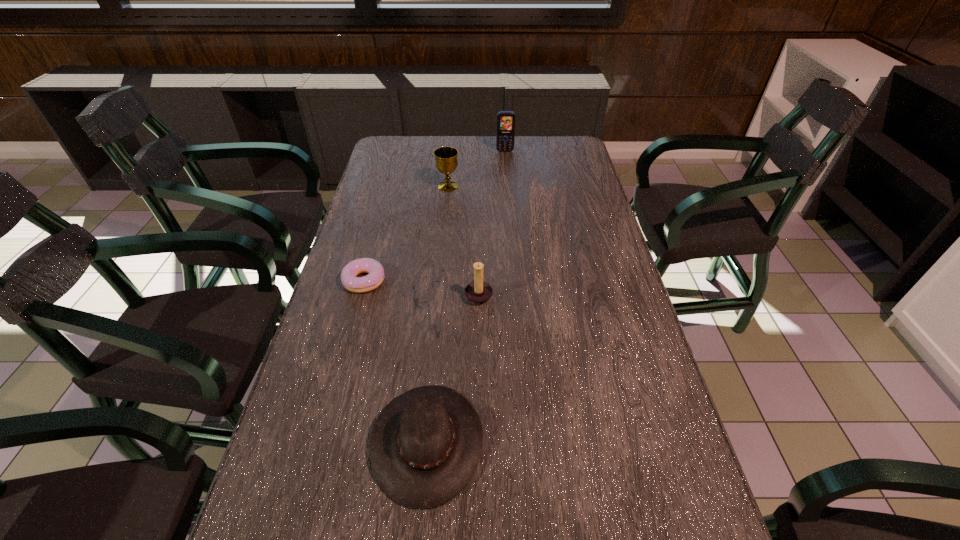
I want to click on cellular telephone, so click(505, 135).

Image resolution: width=960 pixels, height=540 pixels. What are the coordinates of `the farthest object` in the screenshot? It's located at [505, 135].

The height and width of the screenshot is (540, 960). I want to click on the fourth nearest object, so click(446, 162).

Where is `candle holder`? This screenshot has height=540, width=960. candle holder is located at coordinates (478, 292).

Where is `the second shortest object`? The image size is (960, 540). the second shortest object is located at coordinates (425, 445).

The image size is (960, 540). I want to click on the nearest object, so click(x=425, y=445).

You are a GUI agent. You are given a task and a screenshot of the screen. Output one action in this format:
    pyautogui.click(x=<x>, y=<y>)
    Task: Click on the shortest object
    
    Given the screenshot: What is the action you would take?
    pyautogui.click(x=367, y=283)

Identify the location of the leftmost object. (367, 283).

Image resolution: width=960 pixels, height=540 pixels. Identify the location of vacant space situated on the screen of the tallest object. 508,185.

The width and height of the screenshot is (960, 540). I want to click on vacant space located 0.060m on the left of the second farthest object, so click(419, 186).